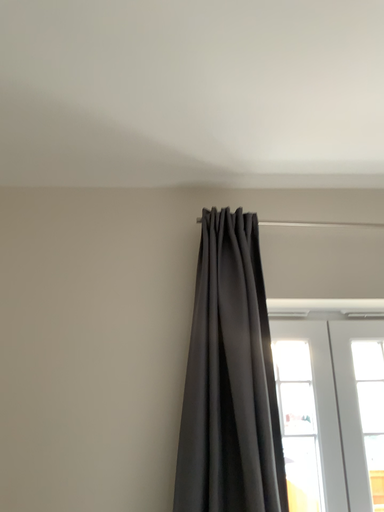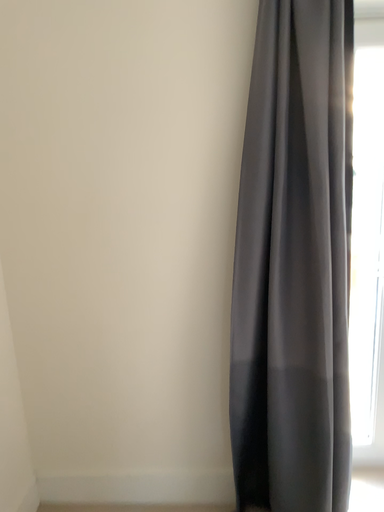
Question: How did the camera likely rotate when shooting the video?

Choices:
 (A) rotated downward
 (B) rotated upward

Answer: (A)